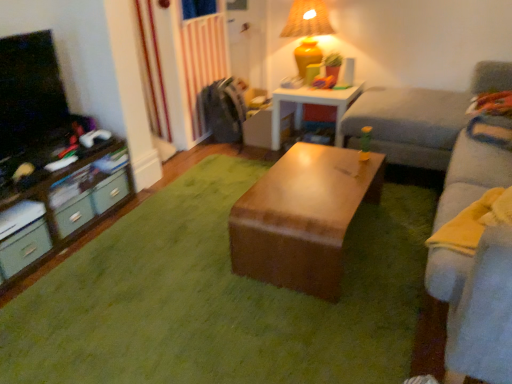
Question: From a real-world perspective, is gray fabric couch at center on light gray fabric couch at right?

Choices:
 (A) no
 (B) yes

Answer: (A)

Question: Can you confirm if gray fabric couch at center is thinner than light gray fabric couch at right?

Choices:
 (A) yes
 (B) no

Answer: (B)

Question: Does gray fabric couch at center have a greater height compared to light gray fabric couch at right?

Choices:
 (A) yes
 (B) no

Answer: (B)

Question: Is gray fabric couch at center in front of light gray fabric couch at right?

Choices:
 (A) yes
 (B) no

Answer: (B)

Question: Is gray fabric couch at center looking in the opposite direction of light gray fabric couch at right?

Choices:
 (A) no
 (B) yes

Answer: (A)

Question: Considering the relative sizes of gray fabric couch at center and light gray fabric couch at right in the image provided, is gray fabric couch at center shorter than light gray fabric couch at right?

Choices:
 (A) no
 (B) yes

Answer: (A)

Question: From the image's perspective, does matte black desk at left appear lower than matte gray drawer at lower left, placed as the first drawer when sorted from front to back?

Choices:
 (A) yes
 (B) no

Answer: (B)

Question: Is matte gray drawer at lower left, placed as the first drawer when sorted from front to back, located within matte black desk at left?

Choices:
 (A) yes
 (B) no

Answer: (A)

Question: Is matte black desk at left shorter than matte gray drawer at lower left, the third drawer in the back-to-front sequence?

Choices:
 (A) yes
 (B) no

Answer: (B)

Question: Is matte black desk at left positioned beyond the bounds of matte gray drawer at lower left, placed as the first drawer when sorted from front to back?

Choices:
 (A) yes
 (B) no

Answer: (A)

Question: Is matte black desk at left looking in the opposite direction of matte gray drawer at lower left, the third drawer in the back-to-front sequence?

Choices:
 (A) yes
 (B) no

Answer: (A)

Question: From the image's perspective, is matte black desk at left above matte gray drawer at lower left, placed as the first drawer when sorted from front to back?

Choices:
 (A) no
 (B) yes

Answer: (B)

Question: From the image's perspective, is wooden table at center, the second table positioned from the bottom, over light gray fabric couch at right?

Choices:
 (A) yes
 (B) no

Answer: (A)